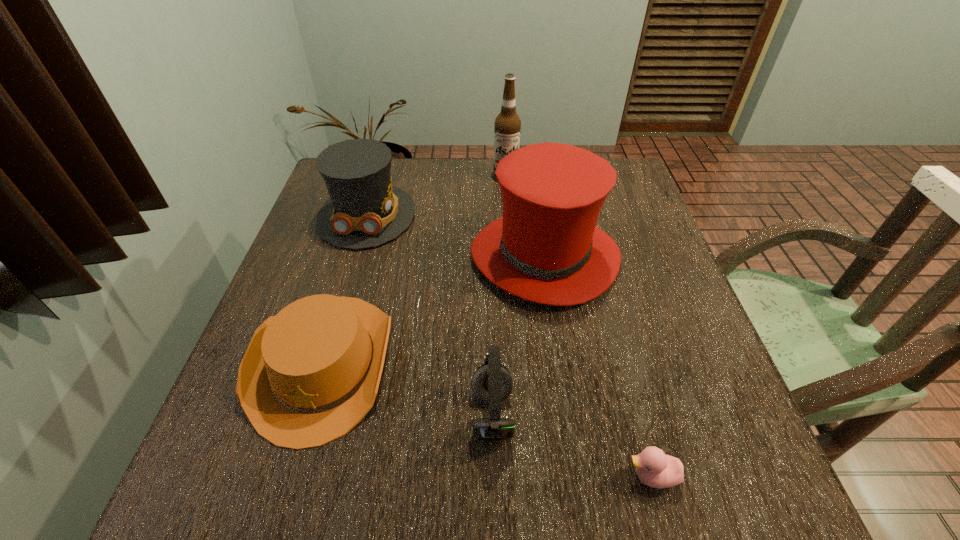
The width and height of the screenshot is (960, 540). What are the coordinates of `free space at the left edge` in the screenshot? It's located at [271, 448].

This screenshot has width=960, height=540. In the image, there is a desktop. What are the coordinates of `free space at the right edge` in the screenshot? It's located at (670, 440).

What are the coordinates of `free space at the far right corner` in the screenshot? It's located at (626, 193).

Find the location of a particular element. vacant space that is in between the left dress hat and the cowboy hat is located at coordinates (346, 289).

You are a GUI agent. You are given a task and a screenshot of the screen. Output one action in this format:
    pyautogui.click(x=<x>, y=<y>)
    Task: Click on the vacant point located between the right dress hat and the nearest object
    This screenshot has width=960, height=540.
    Given the screenshot: What is the action you would take?
    pyautogui.click(x=598, y=367)

Find the location of a particular element. vacant area that lies between the tallest object and the shorter dress hat is located at coordinates (436, 194).

Locate an element on the screen. free spot between the left dress hat and the cowboy hat is located at coordinates (346, 289).

Image resolution: width=960 pixels, height=540 pixels. I want to click on vacant space that is in between the left dress hat and the tallest object, so click(436, 194).

Where is `vacant area that lies between the headset and the cowboy hat`? vacant area that lies between the headset and the cowboy hat is located at coordinates (408, 389).

Find the location of a particular element. Image resolution: width=960 pixels, height=540 pixels. free spot between the headset and the duckling is located at coordinates (572, 446).